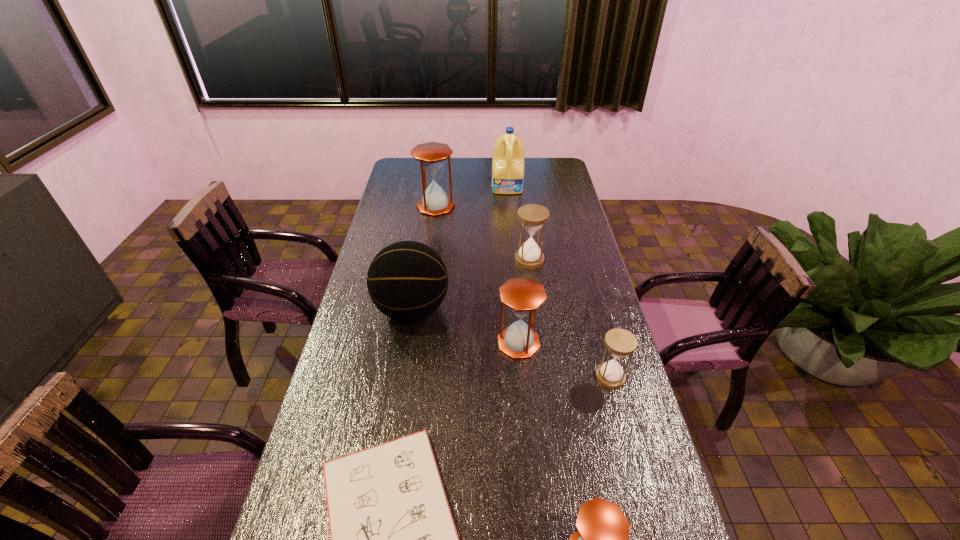
Where is `detergent`? This screenshot has width=960, height=540. detergent is located at coordinates (508, 154).

What are the coordinates of `the farthest hourglass` in the screenshot? It's located at (432, 155).

Where is `the farthest brown hourglass`? This screenshot has height=540, width=960. the farthest brown hourglass is located at coordinates (432, 155).

The image size is (960, 540). Identify the location of black basketball. tap(407, 280).

Image resolution: width=960 pixels, height=540 pixels. I want to click on the second farthest brown hourglass, so click(522, 296).

Identify the location of the second smallest brown hourglass. The height and width of the screenshot is (540, 960). (522, 296).

What are the coordinates of `the farther white hourglass` in the screenshot? It's located at (532, 216).

The image size is (960, 540). Find the location of `the sixth nearest object`. the sixth nearest object is located at coordinates (532, 216).

Where is `the right white hourglass`? The height and width of the screenshot is (540, 960). the right white hourglass is located at coordinates (620, 343).

I want to click on the smaller white hourglass, so click(x=620, y=343).